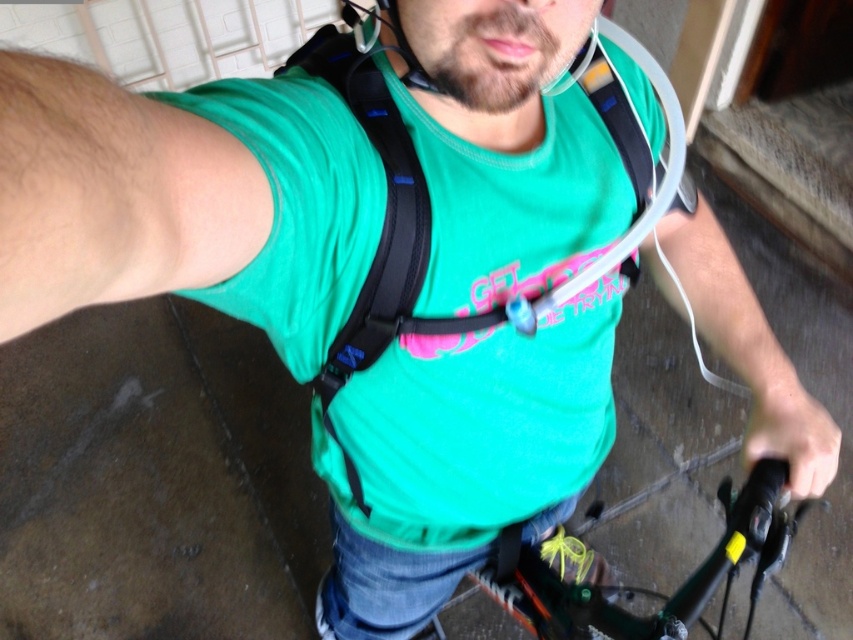
You are navigating a narrow corridor and need to pass through a doorway that is only 1.2 meters wide. You observe the green matte bicycle handlebars at lower center and the matte black helmet at upper center. Which object is positioned to the right side of the other?

The green matte bicycle handlebars at lower center are to the right of the matte black helmet at upper center, so the handlebars are on the right side.

You are standing at point (399, 22) and want to walk to the metal gate or railing in the upper left corner. Is the point (409, 292) in your path?

Point (409, 292) is behind point (399, 22), so it is not in your path to the metal gate or railing in the upper left corner.